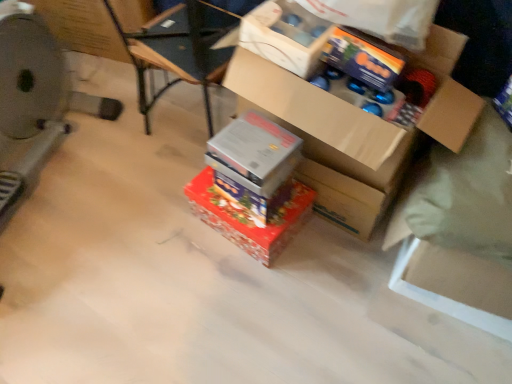
The image size is (512, 384). Identify the location of free space above cardboard box at upper center (from a real-world perspective). (291, 5).